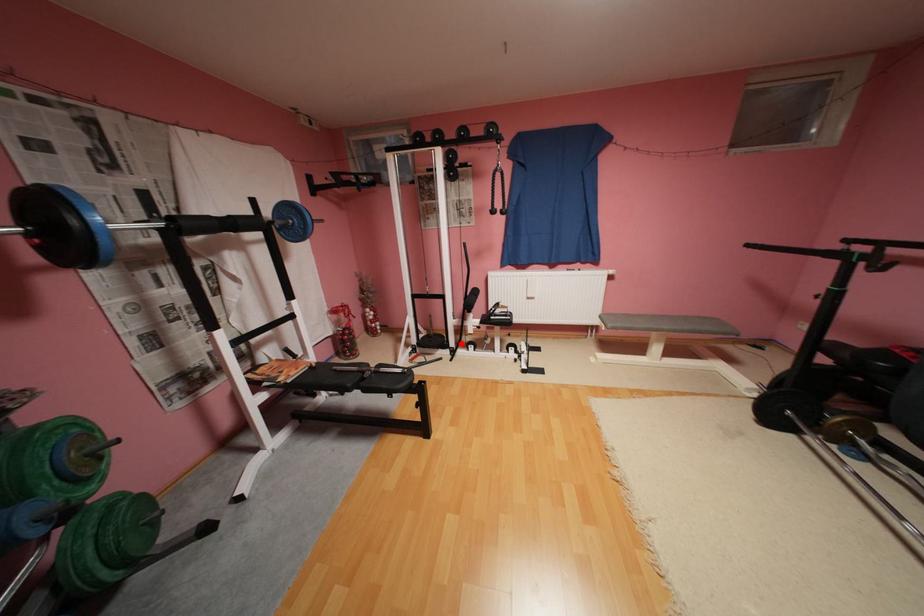
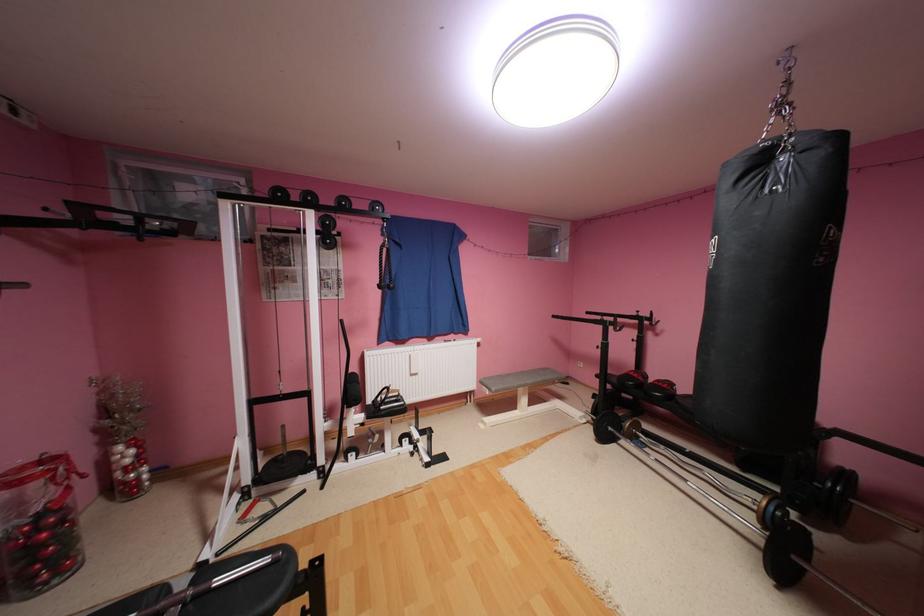
Question: I am providing you with two images of the same scene from different viewpoints. A red point is shown in image1. For the corresponding object point in image2, is it positioned nearer or farther from the camera?

Choices:
 (A) Nearer
 (B) Farther

Answer: (A)